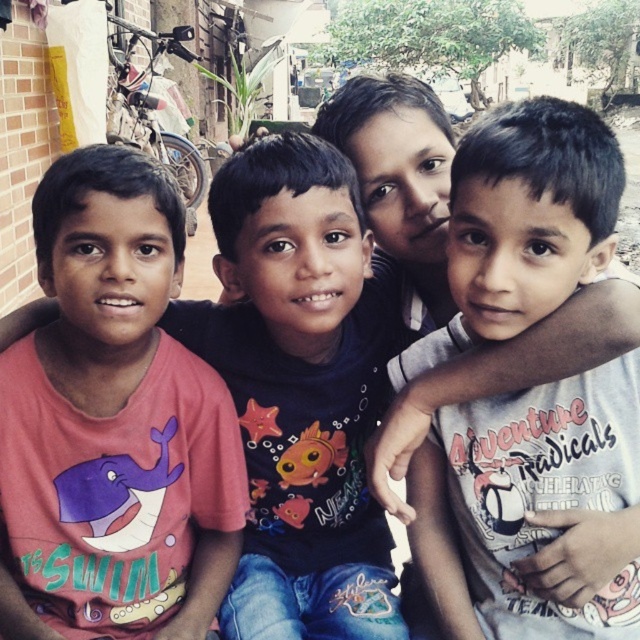
Consider the image. What is the color and material of the shirt at the point marked by coordinates (525, 500)?

The shirt at the point marked by coordinates (525, 500) is white and matte in material.